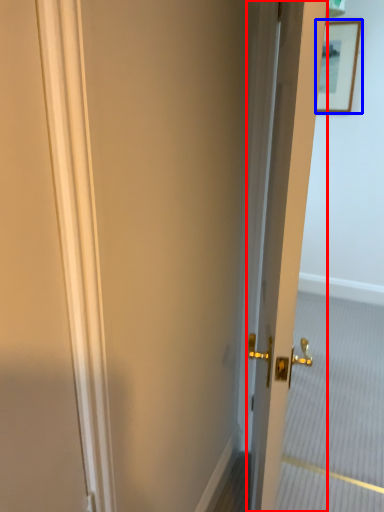
Question: Which object appears closest to the camera in this image, door (highlighted by a red box) or picture frame (highlighted by a blue box)?

Choices:
 (A) door
 (B) picture frame

Answer: (A)